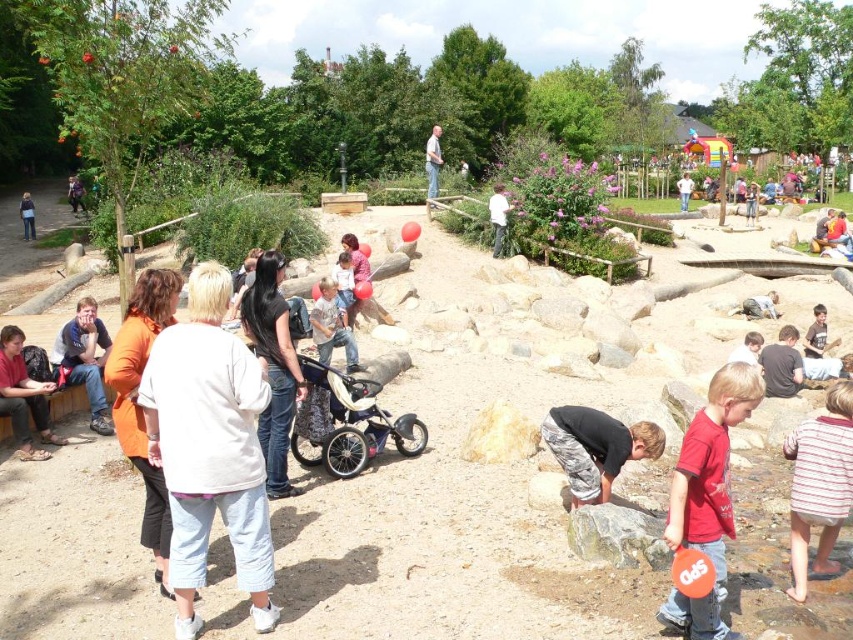
Question: Is smooth gray rock at lower center below matte red shirt at left?

Choices:
 (A) yes
 (B) no

Answer: (A)

Question: Which object is farther from the camera taking this photo?

Choices:
 (A) light blue denim jeans at center
 (B) dark brown leather jacket at center
 (C) striped cotton shirt at lower right
 (D) red matte shirt at lower right

Answer: (A)

Question: Which of these objects is positioned closest to the light blue jeans at center?

Choices:
 (A) white cotton sweater at center
 (B) smooth gray rock at lower center
 (C) camouflage pants at lower center

Answer: (C)

Question: Does orange fabric jacket at lower left lie behind matte blue shirt at left?

Choices:
 (A) no
 (B) yes

Answer: (A)

Question: Does orange fabric jacket at lower left have a greater width compared to striped cotton shirt at lower right?

Choices:
 (A) no
 (B) yes

Answer: (B)

Question: Which object is closer to the camera taking this photo?

Choices:
 (A) camouflage pants at lower center
 (B) dark brown leather jacket at center
 (C) smooth gray rock at lower center
 (D) striped cotton shirt at lower right

Answer: (D)